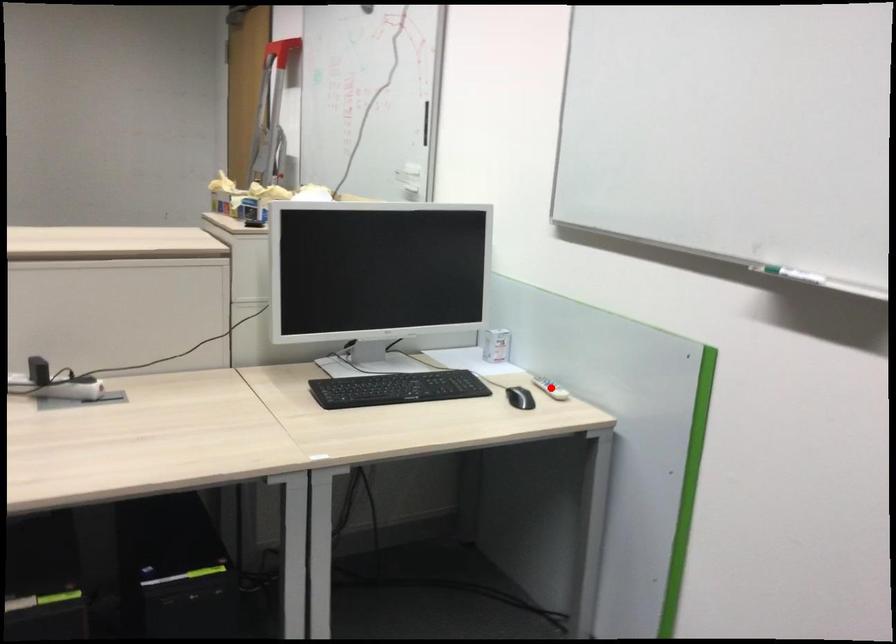
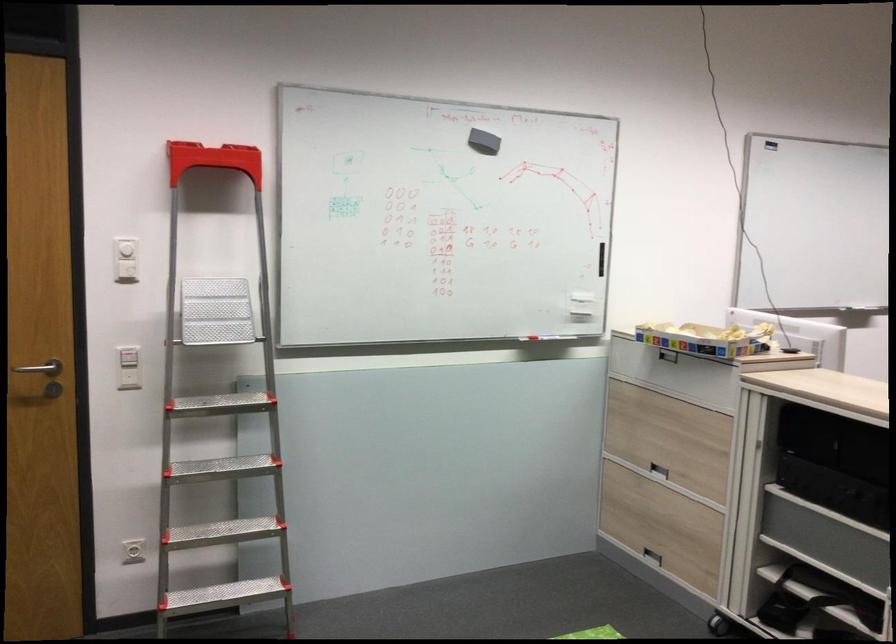
Question: I am providing you with two images of the same scene from different viewpoints. A red point is marked on the first image. Can you still see the location of the red point in image 2?

Choices:
 (A) Yes
 (B) No

Answer: (B)